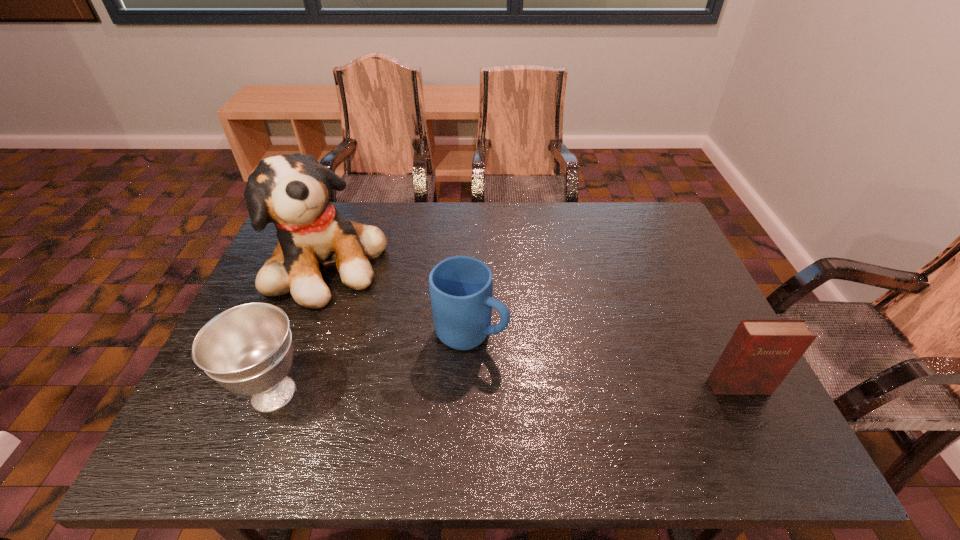
Where is `chalice`? chalice is located at coordinates (247, 349).

At what (x,y) coordinates should I click in order to perform the action: click on diary. Please return your answer as a coordinate pair (x, y). Looking at the image, I should click on (761, 352).

This screenshot has height=540, width=960. In order to click on puppy in this screenshot , I will do click(292, 191).

Image resolution: width=960 pixels, height=540 pixels. Identify the location of mug. (461, 287).

The height and width of the screenshot is (540, 960). Find the location of `vacant space located 0.210m on the right of the chalice`. vacant space located 0.210m on the right of the chalice is located at coordinates (409, 394).

You are a GUI agent. You are given a task and a screenshot of the screen. Output one action in this format:
    pyautogui.click(x=<x>, y=<y>)
    Task: Click on the vacant space situated 0.050m on the front cover of the diary
    The width and height of the screenshot is (960, 540).
    Given the screenshot: What is the action you would take?
    pyautogui.click(x=753, y=415)

Locate an element on the screen. The height and width of the screenshot is (540, 960). vacant space located 0.310m at the face of the tallest object is located at coordinates (444, 360).

What are the coordinates of `free space located 0.240m at the face of the tallest object` in the screenshot? It's located at [x=423, y=343].

Image resolution: width=960 pixels, height=540 pixels. What are the coordinates of `free space located at the face of the tallest object` in the screenshot? It's located at (418, 339).

This screenshot has width=960, height=540. What are the coordinates of `vacant space located on the side of the second object from right to left with the handle` in the screenshot? It's located at (593, 397).